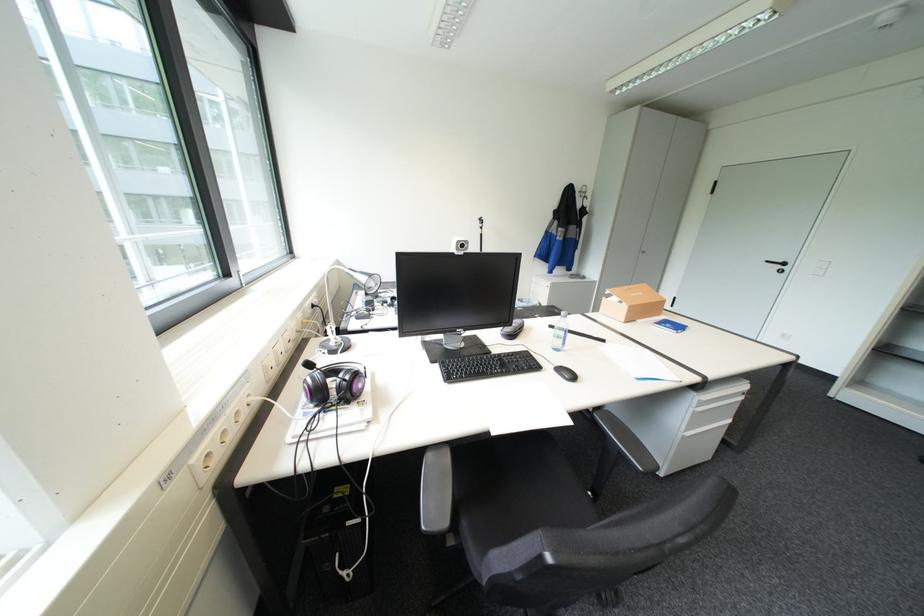
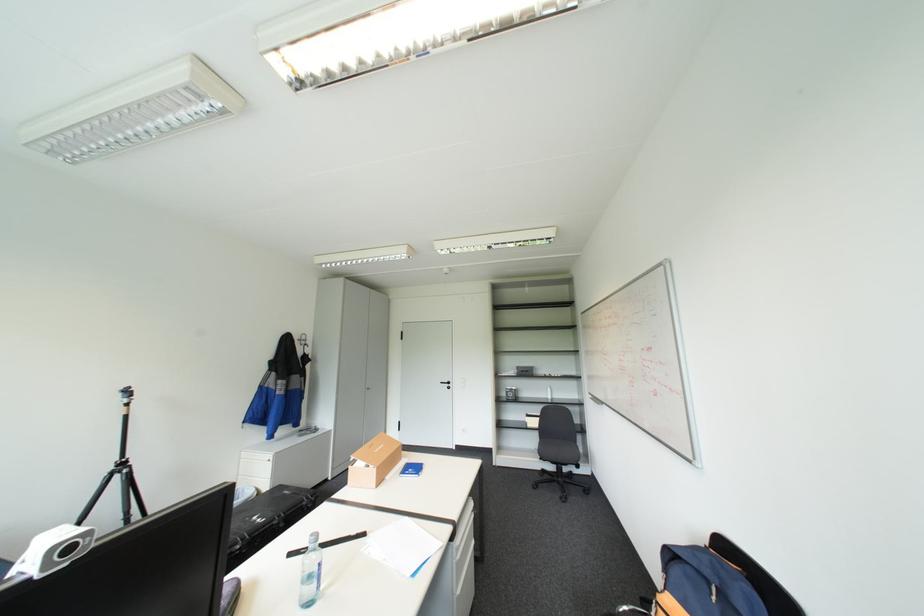
Locate, in the second image, the point that corresponds to (563,334) in the first image.

(310, 581)